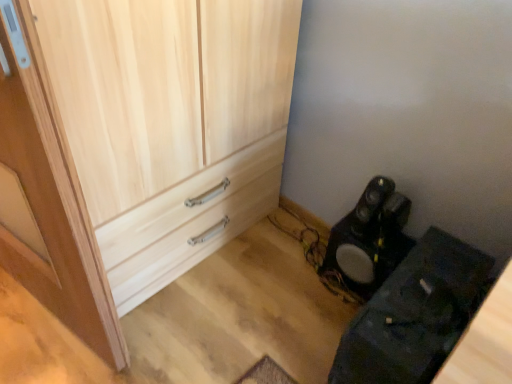
Where is `vacant area that is in front of natural wood cupboard at center`? vacant area that is in front of natural wood cupboard at center is located at coordinates (169, 334).